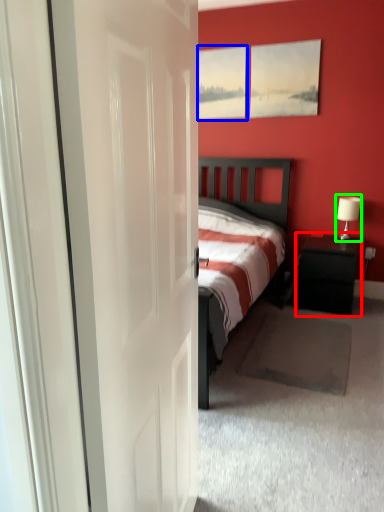
Question: Which object is positioned farthest from nightstand (highlighted by a red box)? Select from window (highlighted by a blue box) and table lamp (highlighted by a green box).

Choices:
 (A) window
 (B) table lamp

Answer: (A)